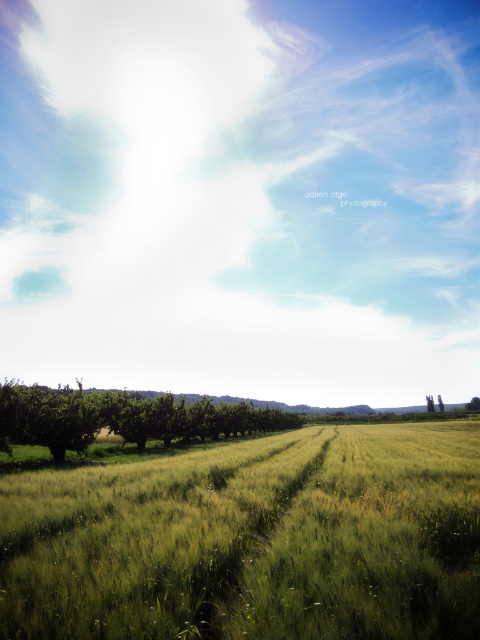
Which is more to the left, green grassy wheat field at lower center or green leafy tree at lower left?

green leafy tree at lower left is more to the left.

Is point (457, 536) farther from viewer compared to point (96, 404)?

No.

Locate an element on the screen. This screenshot has height=640, width=480. green grassy wheat field at lower center is located at coordinates (252, 540).

In order to click on green grassy wheat field at lower center in this screenshot , I will do `click(252, 540)`.

Which is more to the right, bright white cloud at upper center or green grassy wheat field at lower center?

Positioned to the right is green grassy wheat field at lower center.

Which is below, bright white cloud at upper center or green grassy wheat field at lower center?

green grassy wheat field at lower center is lower down.

This screenshot has height=640, width=480. I want to click on bright white cloud at upper center, so click(x=241, y=196).

Is bright white cloud at upper center below green leafy tree at lower left?

No, bright white cloud at upper center is not below green leafy tree at lower left.

Is bright white cloud at upper center positioned in front of green leafy tree at lower left?

No.

This screenshot has width=480, height=640. What do you see at coordinates (241, 196) in the screenshot?
I see `bright white cloud at upper center` at bounding box center [241, 196].

Where is `bright white cloud at upper center`? The width and height of the screenshot is (480, 640). bright white cloud at upper center is located at coordinates (241, 196).